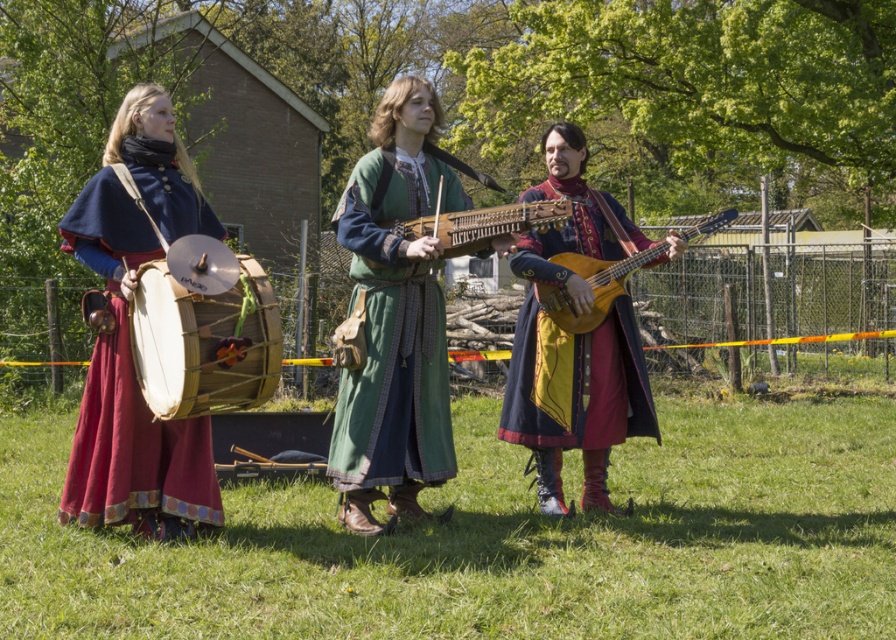
You are standing in the grassy area and want to walk towards the velvet blue coat at center. Which direction should you head relative to the drum player on the left?

The velvet blue coat at center is located at point (x=576, y=381), so you should head towards the center of the image from the drum player on the left.

You are a stagehand setting up for a medieval fair. You need to place a 5.5 feet long banner between the natural wood drum at left and the wooden acoustic guitar at center. Will there be enough space?

The distance between the natural wood drum at left and the wooden acoustic guitar at center is 6.10 feet. Since the banner is 5.5 feet long, it will fit with 0.6 feet of space remaining.